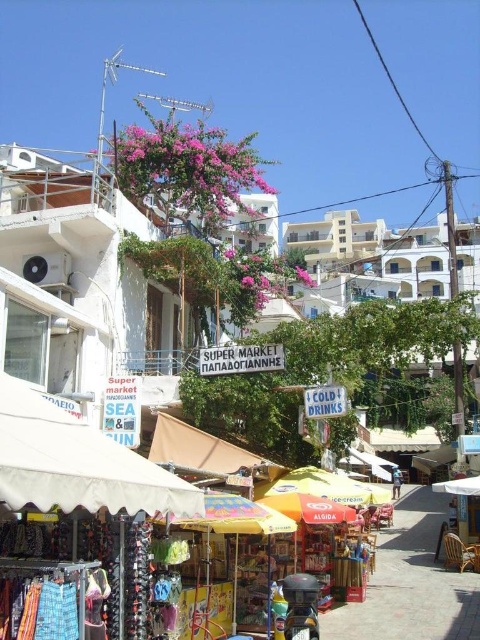
You are standing at the center of the street in the Mediterranean town. You want to find the white fabric canopy at lower left. Which direction should you look to see it?

You should look to the lower left direction to see the white fabric canopy at lower left, as its 2D location is at point [78,464].

You are a tourist standing at the entrance of the market. You see the white fabric canopy at lower left and the yellow fabric umbrella at center. Which one is closer to you?

The white fabric canopy at lower left is closer to you because it is in front of the yellow fabric umbrella at center.